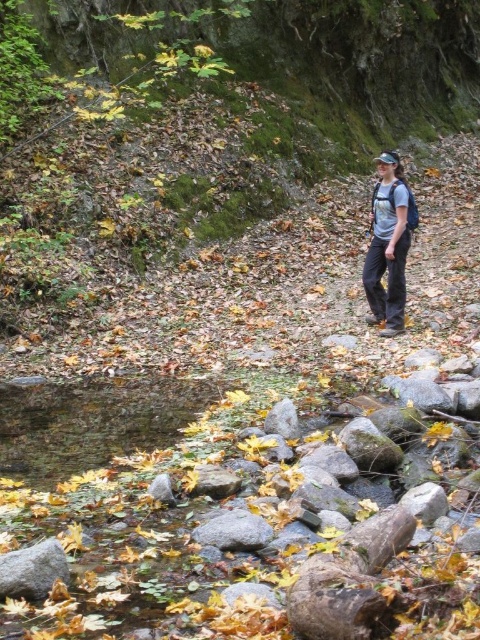
Question: Which object is the closest to the green mossy hillside at center?

Choices:
 (A) gray rock at lower left
 (B) matte gray shirt at center

Answer: (B)

Question: Is green mossy hillside at center positioned before matte gray shirt at center?

Choices:
 (A) no
 (B) yes

Answer: (B)

Question: Can you confirm if green mossy hillside at center is positioned below matte gray shirt at center?

Choices:
 (A) no
 (B) yes

Answer: (A)

Question: Which is nearer to the green mossy hillside at center?

Choices:
 (A) gray rock at lower left
 (B) matte gray shirt at center

Answer: (B)

Question: Is green mossy hillside at center smaller than gray rock at lower left?

Choices:
 (A) no
 (B) yes

Answer: (A)

Question: Which object is farther from the camera taking this photo?

Choices:
 (A) matte gray shirt at center
 (B) green mossy hillside at center
 (C) gray rock at lower left

Answer: (A)